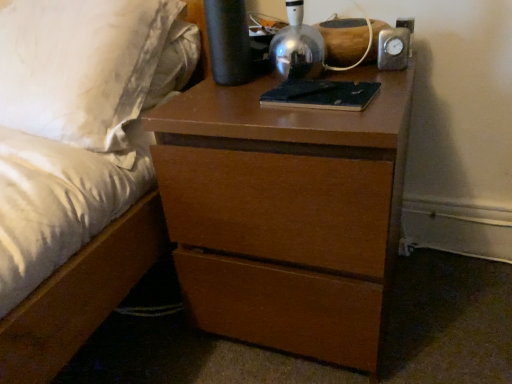
At what (x,y) coordinates should I click in order to perform the action: click on vacant space to the right of metallic dome at upper center. Please return your answer as a coordinate pair (x, y). This screenshot has width=512, height=384. Looking at the image, I should click on (362, 72).